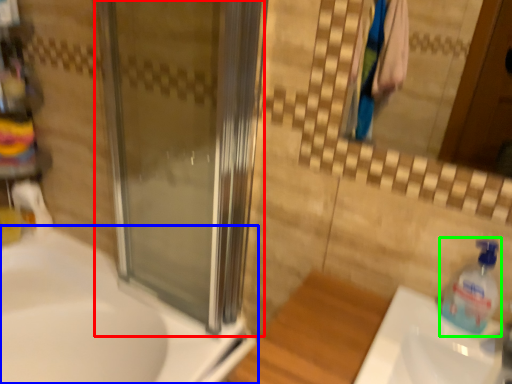
Question: Considering the real-world distances, which object is farthest from screen door (highlighted by a red box)? sink (highlighted by a blue box) or cleaning product (highlighted by a green box)?

Choices:
 (A) sink
 (B) cleaning product

Answer: (B)